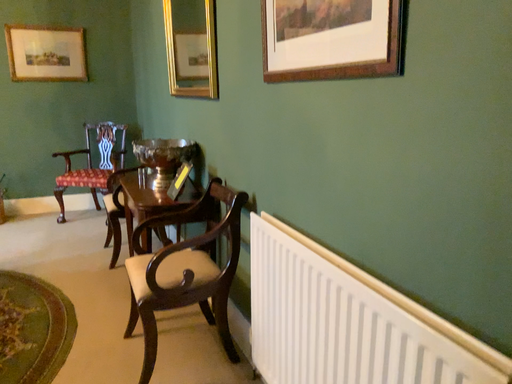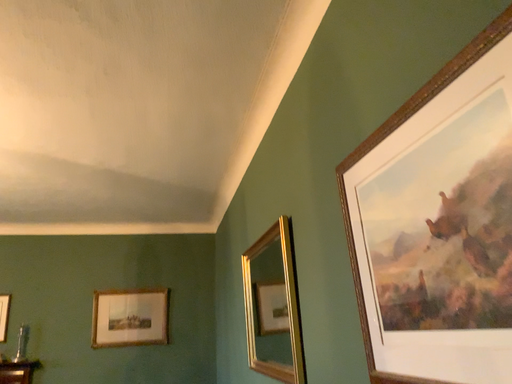
Question: How did the camera likely rotate when shooting the video?

Choices:
 (A) rotated right
 (B) rotated left

Answer: (B)